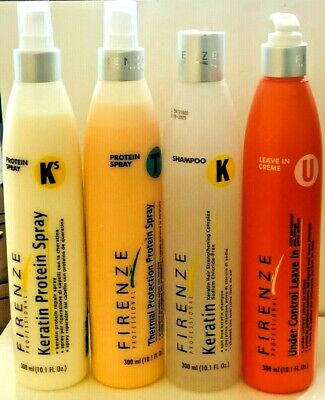
This screenshot has height=400, width=325. Find the location of `bottles`. bottles is located at coordinates (287, 144), (220, 143), (110, 122), (43, 137).